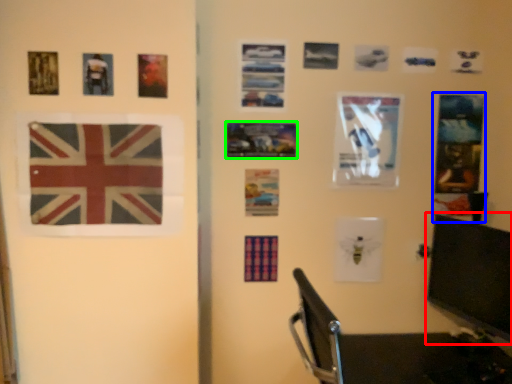
Question: Considering the real-world distances, which object is closest to computer monitor (highlighted by a red box)? postcard (highlighted by a blue box) or picture frame (highlighted by a green box).

Choices:
 (A) postcard
 (B) picture frame

Answer: (A)